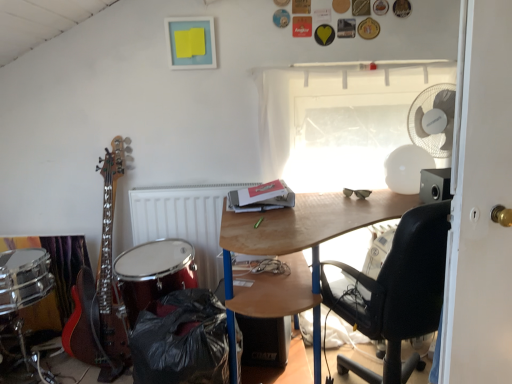
At what (x,y) coordinates should I click in order to perform the action: click on vacant area situated to the left side of satin black sunglasses at upper center. Please return your answer as a coordinate pair (x, y). The image size is (512, 384). Looking at the image, I should click on (323, 197).